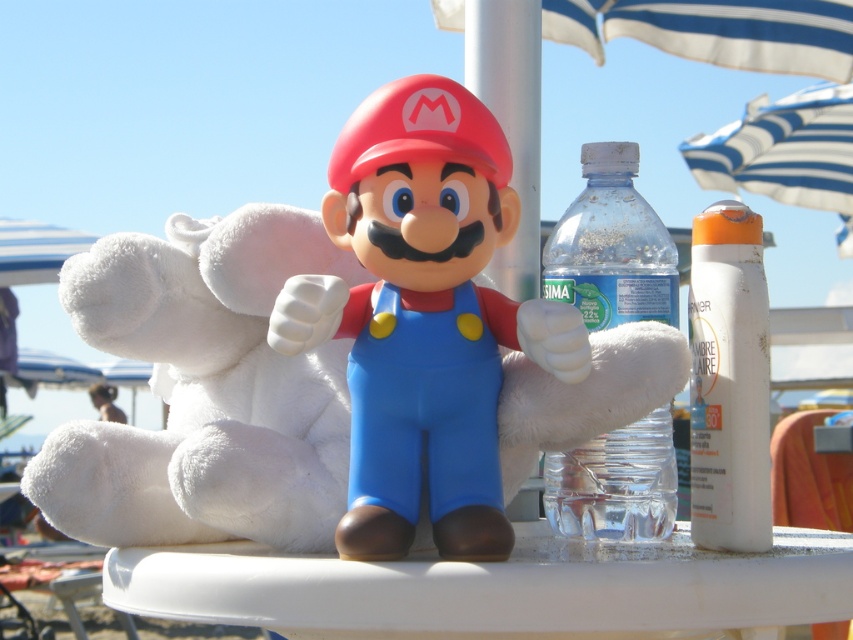
Question: Among these objects, which one is farthest from the camera?

Choices:
 (A) white plastic table at center
 (B) matte plastic mario at center
 (C) transparent plastic bottle at center

Answer: (C)

Question: Is transparent plastic bottle at center to the left of white plastic sunscreen at right from the viewer's perspective?

Choices:
 (A) yes
 (B) no

Answer: (A)

Question: Does matte plastic mario at center have a larger size compared to transparent plastic bottle at center?

Choices:
 (A) yes
 (B) no

Answer: (A)

Question: Is transparent plastic bottle at center to the right of white plastic sunscreen at right from the viewer's perspective?

Choices:
 (A) yes
 (B) no

Answer: (B)

Question: Which point is farther to the camera?

Choices:
 (A) white plastic sunscreen at right
 (B) white plastic table at center

Answer: (A)

Question: Which object is the farthest from the white plastic table at center?

Choices:
 (A) matte plastic mario at center
 (B) white plastic sunscreen at right
 (C) transparent plastic bottle at center

Answer: (C)